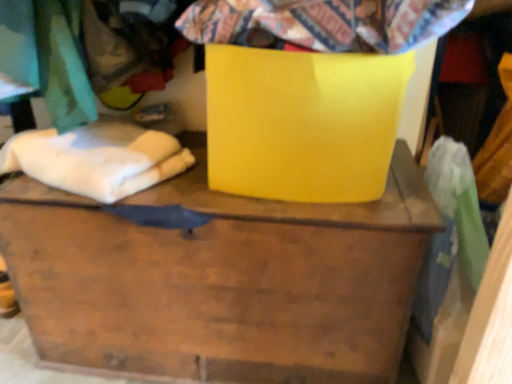
Question: Is white soft cloth at left facing away from matte yellow container at center?

Choices:
 (A) yes
 (B) no

Answer: (B)

Question: Considering the relative sizes of white soft cloth at left and matte yellow container at center in the image provided, is white soft cloth at left taller than matte yellow container at center?

Choices:
 (A) no
 (B) yes

Answer: (A)

Question: From a real-world perspective, does white soft cloth at left stand above matte yellow container at center?

Choices:
 (A) yes
 (B) no

Answer: (A)

Question: From a real-world perspective, is white soft cloth at left under matte yellow container at center?

Choices:
 (A) yes
 (B) no

Answer: (B)

Question: Is white soft cloth at left facing towards matte yellow container at center?

Choices:
 (A) yes
 (B) no

Answer: (B)

Question: Considering the positions of matte yellow container at center and glossy yellow cardboard box at center in the image, is matte yellow container at center bigger or smaller than glossy yellow cardboard box at center?

Choices:
 (A) big
 (B) small

Answer: (A)

Question: Choose the correct answer: Is matte yellow container at center inside glossy yellow cardboard box at center or outside it?

Choices:
 (A) inside
 (B) outside

Answer: (B)

Question: Looking at their shapes, would you say matte yellow container at center is wider or thinner than glossy yellow cardboard box at center?

Choices:
 (A) thin
 (B) wide

Answer: (B)

Question: From a real-world perspective, is matte yellow container at center positioned above or below glossy yellow cardboard box at center?

Choices:
 (A) above
 (B) below

Answer: (B)

Question: In terms of height, does white soft cloth at left look taller or shorter compared to matte yellow container at center?

Choices:
 (A) tall
 (B) short

Answer: (B)

Question: Considering the positions of white soft cloth at left and matte yellow container at center in the image, is white soft cloth at left wider or thinner than matte yellow container at center?

Choices:
 (A) wide
 (B) thin

Answer: (B)

Question: Considering their positions, is white soft cloth at left located in front of or behind matte yellow container at center?

Choices:
 (A) front
 (B) behind

Answer: (B)

Question: Based on their sizes in the image, would you say white soft cloth at left is bigger or smaller than matte yellow container at center?

Choices:
 (A) big
 (B) small

Answer: (B)

Question: From the image's perspective, is white soft cloth at left located above or below flannel fabric at upper center?

Choices:
 (A) below
 (B) above

Answer: (A)

Question: Is white soft cloth at left inside the boundaries of flannel fabric at upper center, or outside?

Choices:
 (A) inside
 (B) outside

Answer: (B)